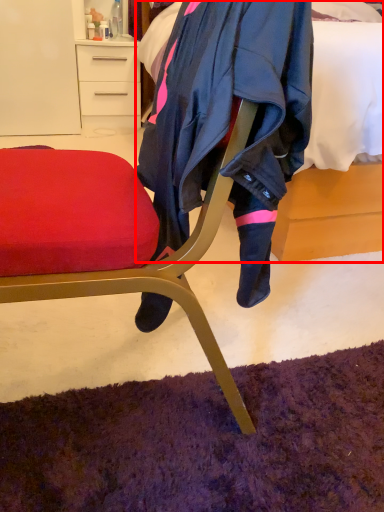
Question: From the image, what is the correct spatial relationship of bed (annotated by the red box) in relation to desk?

Choices:
 (A) left
 (B) right

Answer: (B)